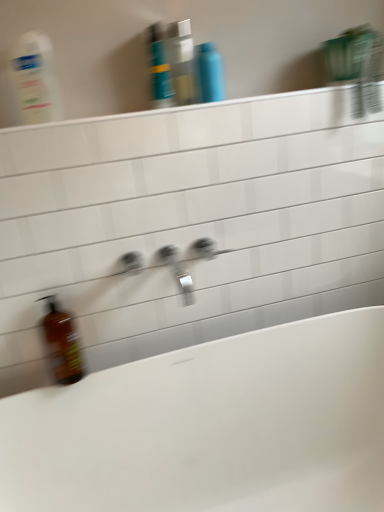
Find the location of a particular element. white glossy ledge at upper center is located at coordinates (252, 112).

The image size is (384, 512). In order to click on white glossy bathtub at lower left in this screenshot , I will do `click(211, 426)`.

Image resolution: width=384 pixels, height=512 pixels. What are the coordinates of `translucent plastic mouthwash at upper center, the first mouthwash viewed from the left` in the screenshot? It's located at (181, 60).

What do you see at coordinates (35, 80) in the screenshot? I see `translucent plastic bottle at upper left` at bounding box center [35, 80].

What is the approximate height of blue glossy shampoo bottle at upper center?

The height of blue glossy shampoo bottle at upper center is 22.72 centimeters.

I want to click on blue glossy shampoo bottle at upper center, so click(159, 69).

Where is `white glossy ledge at upper center`? white glossy ledge at upper center is located at coordinates (252, 112).

Which is closer, (151, 67) or (174, 254)?

Point (151, 67)

The height and width of the screenshot is (512, 384). Find the location of `tap below the blue glossy shampoo bottle at upper center (from a real-world perspective)`. tap below the blue glossy shampoo bottle at upper center (from a real-world perspective) is located at coordinates (177, 272).

Is blue glossy shampoo bottle at upper center positioned with its back to silver metallic tap at center?

No, silver metallic tap at center is not at the back of blue glossy shampoo bottle at upper center.

Can you tell me how much blue glossy shampoo bottle at upper center and silver metallic tap at center differ in facing direction?

The angular difference between blue glossy shampoo bottle at upper center and silver metallic tap at center is 0.00331 degrees.

Could you tell me if translucent plastic mouthwash at upper center, the first mouthwash viewed from the left, is turned towards white glossy ledge at upper center?

No, translucent plastic mouthwash at upper center, the first mouthwash viewed from the left, is not turned towards white glossy ledge at upper center.

Choose the correct answer: Is translucent plastic mouthwash at upper center, the first mouthwash viewed from the left, inside white glossy ledge at upper center or outside it?

translucent plastic mouthwash at upper center, the first mouthwash viewed from the left, is not inside white glossy ledge at upper center, it's outside.

From the image's perspective, which mouthwash is the 2nd one above the white glossy ledge at upper center? Please provide its 2D coordinates.

[(181, 60)]

Which is less distant, (168, 56) or (349, 104)?

The point (168, 56) is in front.

Is the surface of silver metallic tap at center in direct contact with white glossy ledge at upper center?

No, silver metallic tap at center is not making contact with white glossy ledge at upper center.

In the image, is silver metallic tap at center positioned in front of or behind white glossy ledge at upper center?

Visually, silver metallic tap at center is located behind white glossy ledge at upper center.

From a real-world perspective, between silver metallic tap at center and white glossy ledge at upper center, who is vertically higher?

white glossy ledge at upper center.

Does blue glossy bottle at upper center, marked as the 2th mouthwash in a left-to-right arrangement, contain translucent plastic mouthwash at upper center, the first mouthwash viewed from the left?

No, translucent plastic mouthwash at upper center, the first mouthwash viewed from the left, is located outside of blue glossy bottle at upper center, marked as the 2th mouthwash in a left-to-right arrangement.

The width and height of the screenshot is (384, 512). In order to click on mouthwash behind the translucent plastic mouthwash at upper center, acting as the second mouthwash starting from the right in this screenshot , I will do `click(210, 73)`.

Which of these two, blue glossy bottle at upper center, marked as the 2th mouthwash in a left-to-right arrangement, or translucent plastic mouthwash at upper center, acting as the second mouthwash starting from the right, stands taller?

translucent plastic mouthwash at upper center, acting as the second mouthwash starting from the right, is taller.

From the image's perspective, who appears lower, blue glossy bottle at upper center, which is the first mouthwash from right to left, or translucent plastic mouthwash at upper center, acting as the second mouthwash starting from the right?

blue glossy bottle at upper center, which is the first mouthwash from right to left, from the image's perspective.

Which point is more forward, (159, 89) or (1, 129)?

The point (1, 129) is more forward.

From a real-world perspective, is blue glossy shampoo bottle at upper center physically above white glossy ledge at upper center?

Indeed, from a real-world perspective, blue glossy shampoo bottle at upper center stands above white glossy ledge at upper center.

The image size is (384, 512). Find the location of `ledge on the right side of blue glossy shampoo bottle at upper center`. ledge on the right side of blue glossy shampoo bottle at upper center is located at coordinates (252, 112).

Between blue glossy shampoo bottle at upper center and white glossy ledge at upper center, which one has larger width?

Wider between the two is white glossy ledge at upper center.

Which is more distant, (54, 365) or (261, 115)?

Point (54, 365)

Can you see brown glass bottle at lower left touching white glossy ledge at upper center?

No, brown glass bottle at lower left is not touching white glossy ledge at upper center.

Is the depth of brown glass bottle at lower left greater than that of white glossy ledge at upper center?

Yes, the depth of brown glass bottle at lower left is greater than that of white glossy ledge at upper center.

From a real-world perspective, is brown glass bottle at lower left positioned above or below white glossy ledge at upper center?

From a real-world perspective, brown glass bottle at lower left is physically below white glossy ledge at upper center.

Which object is further away from the camera, translucent plastic mouthwash at upper center, acting as the second mouthwash starting from the right, or silver metallic tap at center?

translucent plastic mouthwash at upper center, acting as the second mouthwash starting from the right, is further away from the camera.

Which of these two, translucent plastic mouthwash at upper center, the first mouthwash viewed from the left, or silver metallic tap at center, stands shorter?

Standing shorter between the two is silver metallic tap at center.

Who is smaller, translucent plastic mouthwash at upper center, acting as the second mouthwash starting from the right, or silver metallic tap at center?

With smaller size is translucent plastic mouthwash at upper center, acting as the second mouthwash starting from the right.

You are a GUI agent. You are given a task and a screenshot of the screen. Output one action in this format:
    pyautogui.click(x=<x>, y=<y>)
    Task: Click on the toiletry that is on the left side of silver metallic tap at center
    This screenshot has width=384, height=512.
    Given the screenshot: What is the action you would take?
    pyautogui.click(x=159, y=69)

From the image's perspective, starting from the white glossy ledge at upper center, which mouthwash is the 2nd one above? Please provide its 2D coordinates.

[(181, 60)]

From the image, which object appears to be farther from brown glass bottle at lower left, white glossy bathtub at lower left or translucent plastic bottle at upper left?

translucent plastic bottle at upper left lies further to brown glass bottle at lower left than the other object.

Estimate the real-world distances between objects in this image. Which object is further from blue glossy shampoo bottle at upper center, translucent plastic mouthwash at upper center, the first mouthwash viewed from the left, or blue glossy bottle at upper center, which is the first mouthwash from right to left?

Among the two, blue glossy bottle at upper center, which is the first mouthwash from right to left, is located further to blue glossy shampoo bottle at upper center.

Estimate the real-world distances between objects in this image. Which object is further from translucent plastic bottle at upper left, white glossy ledge at upper center or blue glossy shampoo bottle at upper center?

blue glossy shampoo bottle at upper center.

Estimate the real-world distances between objects in this image. Which object is further from translucent plastic bottle at upper left, silver metallic tap at center or translucent plastic mouthwash at upper center, acting as the second mouthwash starting from the right?

silver metallic tap at center.

When comparing their distances from brown glass bottle at lower left, does white glossy bathtub at lower left or translucent plastic mouthwash at upper center, acting as the second mouthwash starting from the right, seem further?

translucent plastic mouthwash at upper center, acting as the second mouthwash starting from the right, lies further to brown glass bottle at lower left than the other object.

Considering their positions, is translucent plastic mouthwash at upper center, acting as the second mouthwash starting from the right, positioned closer to white glossy bathtub at lower left than blue glossy bottle at upper center, marked as the 2th mouthwash in a left-to-right arrangement?

blue glossy bottle at upper center, marked as the 2th mouthwash in a left-to-right arrangement, lies closer to white glossy bathtub at lower left than the other object.

Based on their spatial positions, is silver metallic tap at center or translucent plastic bottle at upper left closer to white glossy ledge at upper center?

translucent plastic bottle at upper left is closer to white glossy ledge at upper center.

Considering their positions, is translucent plastic mouthwash at upper center, acting as the second mouthwash starting from the right, positioned closer to white glossy bathtub at lower left than silver metallic tap at center?

silver metallic tap at center is positioned closer to the anchor white glossy bathtub at lower left.

The image size is (384, 512). What are the coordinates of `ledge between translucent plastic bottle at upper left and white glossy bathtub at lower left vertically` in the screenshot? It's located at (252, 112).

Image resolution: width=384 pixels, height=512 pixels. Find the location of `toiletry situated between translucent plastic bottle at upper left and translucent plastic mouthwash at upper center, acting as the second mouthwash starting from the right, from left to right`. toiletry situated between translucent plastic bottle at upper left and translucent plastic mouthwash at upper center, acting as the second mouthwash starting from the right, from left to right is located at coordinates (159, 69).

Identify the location of tap that lies between white glossy ledge at upper center and white glossy bathtub at lower left from top to bottom. This screenshot has width=384, height=512. (177, 272).

You are a GUI agent. You are given a task and a screenshot of the screen. Output one action in this format:
    pyautogui.click(x=<x>, y=<y>)
    Task: Click on the toiletry between translucent plastic bottle at upper left and white glossy ledge at upper center from left to right
    The height and width of the screenshot is (512, 384).
    Given the screenshot: What is the action you would take?
    pyautogui.click(x=159, y=69)